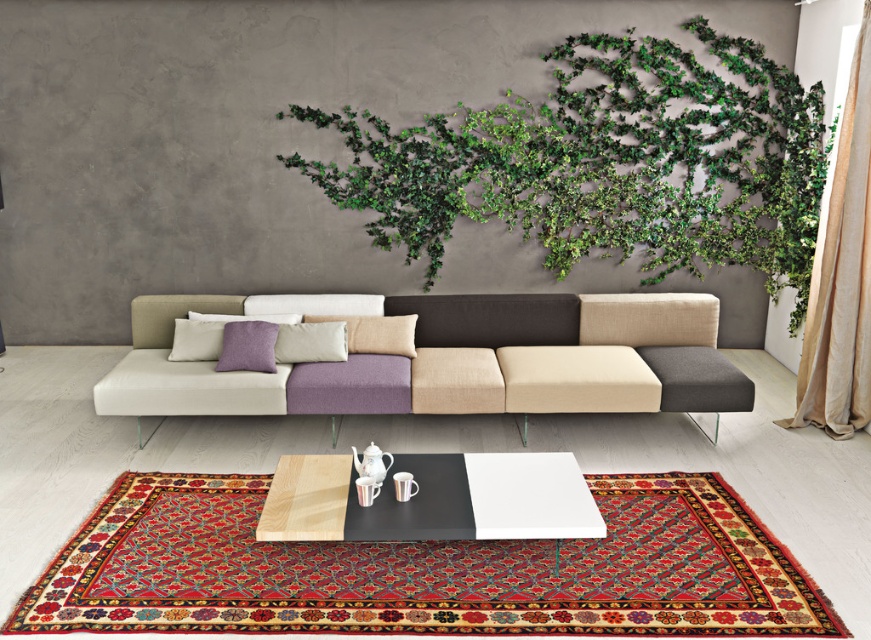
Can you confirm if textured fabric couch at center is taller than wooden table at center?

Yes.

Who is shorter, textured fabric couch at center or wooden table at center?

wooden table at center

Is point (468, 323) farther from viewer compared to point (518, 488)?

Yes, it is behind point (518, 488).

Image resolution: width=871 pixels, height=640 pixels. Identify the location of textured fabric couch at center. click(448, 358).

Locate an element on the screen. Image resolution: width=871 pixels, height=640 pixels. purple textured pillow at center is located at coordinates (247, 346).

This screenshot has height=640, width=871. What do you see at coordinates (247, 346) in the screenshot?
I see `purple textured pillow at center` at bounding box center [247, 346].

The height and width of the screenshot is (640, 871). I want to click on purple textured pillow at center, so 247,346.

Does green leafy wall art at upper center have a lesser width compared to purple matte pillow at center?

No.

Can you confirm if green leafy wall art at upper center is wider than purple matte pillow at center?

Yes, green leafy wall art at upper center is wider than purple matte pillow at center.

Between point (809, 193) and point (316, 358), which one is positioned in front?

Point (316, 358)

Where is `green leafy wall art at upper center`? Image resolution: width=871 pixels, height=640 pixels. green leafy wall art at upper center is located at coordinates (606, 163).